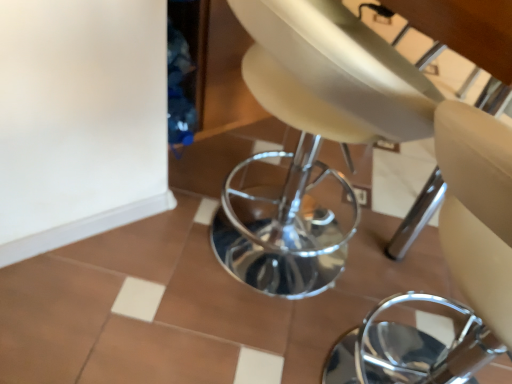
Question: Relative to white glossy tile at lower left, is beige leather chair at center in front or behind?

Choices:
 (A) behind
 (B) front

Answer: (B)

Question: From their relative heights in the image, would you say beige leather chair at center is taller or shorter than white glossy tile at lower left?

Choices:
 (A) tall
 (B) short

Answer: (A)

Question: Based on their relative distances, which object is farther from the white glossy tile at lower left?

Choices:
 (A) beige leather swivel chair at center
 (B) beige leather chair at center

Answer: (B)

Question: Which of these objects is positioned farthest from the beige leather swivel chair at center?

Choices:
 (A) beige leather chair at center
 (B) white glossy tile at lower left

Answer: (A)